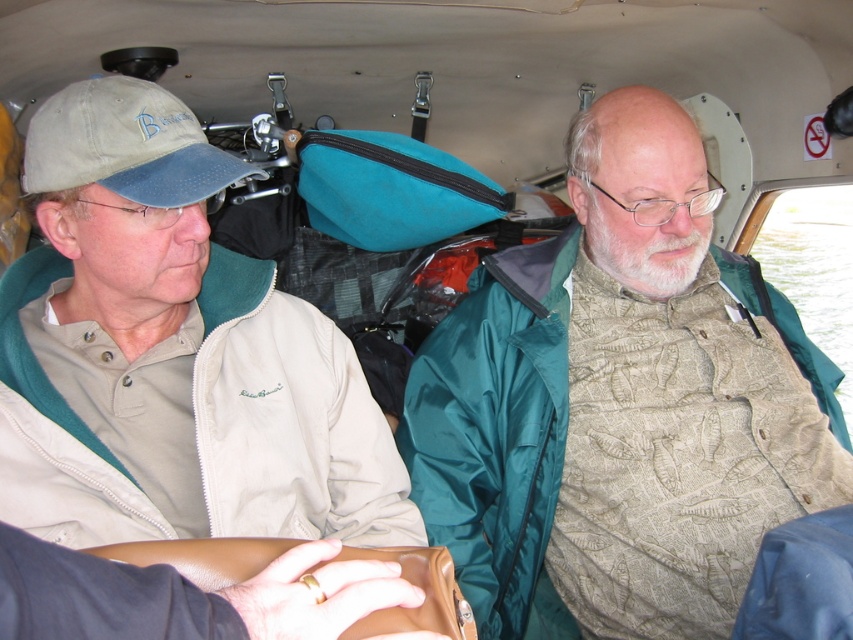
Question: Can you confirm if green textured jacket at center is bigger than beige fleece jacket at left?

Choices:
 (A) no
 (B) yes

Answer: (B)

Question: Among these points, which one is farthest from the camera?

Choices:
 (A) (305, 324)
 (B) (99, 145)
 (C) (500, 580)

Answer: (C)

Question: Is green textured jacket at center behind khaki fabric baseball cap at left?

Choices:
 (A) yes
 (B) no

Answer: (A)

Question: Which point is closer to the camera?

Choices:
 (A) beige fleece jacket at left
 (B) green textured jacket at center
 (C) khaki fabric baseball cap at left

Answer: (C)

Question: Among these points, which one is nearest to the camera?

Choices:
 (A) (196, 387)
 (B) (177, 122)
 (C) (558, 413)

Answer: (B)

Question: Is green textured jacket at center to the right of beige fleece jacket at left from the viewer's perspective?

Choices:
 (A) no
 (B) yes

Answer: (B)